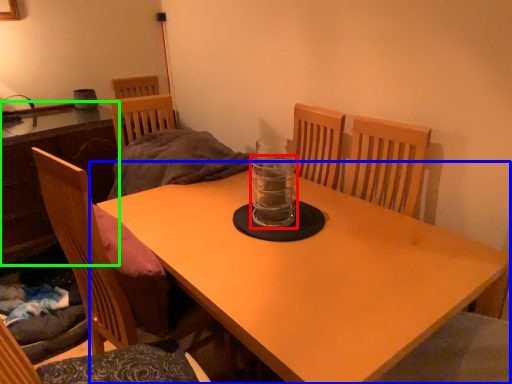
Question: Considering the real-world distances, which object is farthest from glass jar (highlighted by a red box)? table (highlighted by a blue box) or table (highlighted by a green box)?

Choices:
 (A) table
 (B) table

Answer: (B)